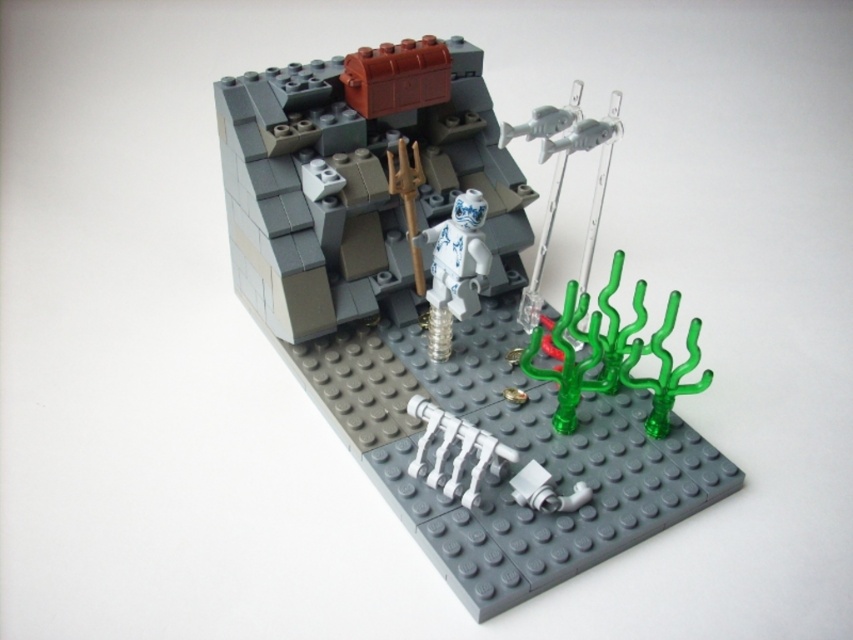
Is white glossy minifigure at center shorter than porcelain figure at center?

Incorrect, white glossy minifigure at center's height does not fall short of porcelain figure at center's.

This screenshot has width=853, height=640. What are the coordinates of `white glossy minifigure at center` in the screenshot? It's located at (425, 314).

Identify the location of white glossy minifigure at center. (425, 314).